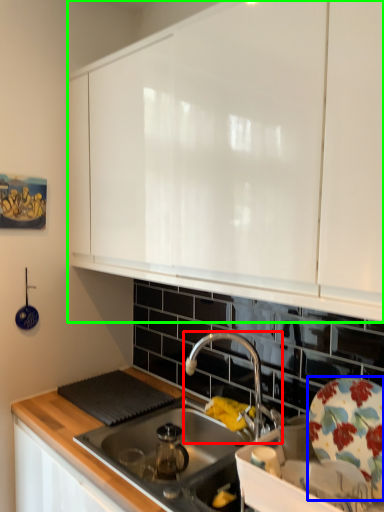
Question: Which object is the farthest from tap (highlighted by a red box)? Choose among these: plate (highlighted by a blue box) or cabinetry (highlighted by a green box).

Choices:
 (A) plate
 (B) cabinetry

Answer: (B)